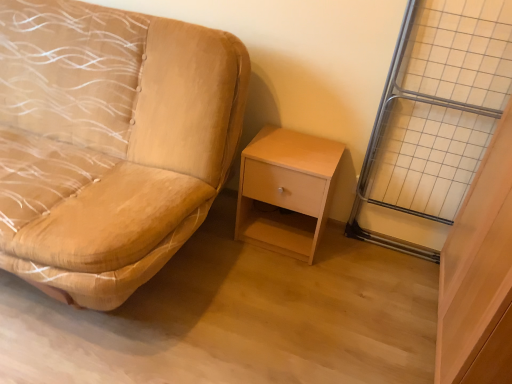
This screenshot has height=384, width=512. Identify the location of vacant region in front of light wood/finely finished nightstand at center-right. (278, 285).